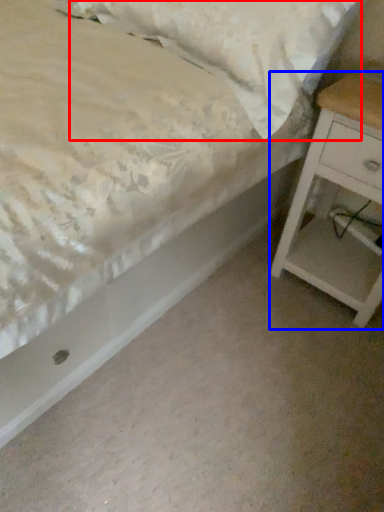
Question: Which object is closer to the camera taking this photo, pillow (highlighted by a red box) or nightstand (highlighted by a blue box)?

Choices:
 (A) pillow
 (B) nightstand

Answer: (A)